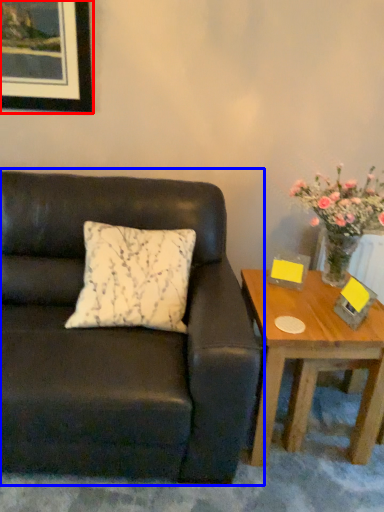
Question: Which object is further to the camera taking this photo, picture frame (highlighted by a red box) or studio couch (highlighted by a blue box)?

Choices:
 (A) picture frame
 (B) studio couch

Answer: (A)